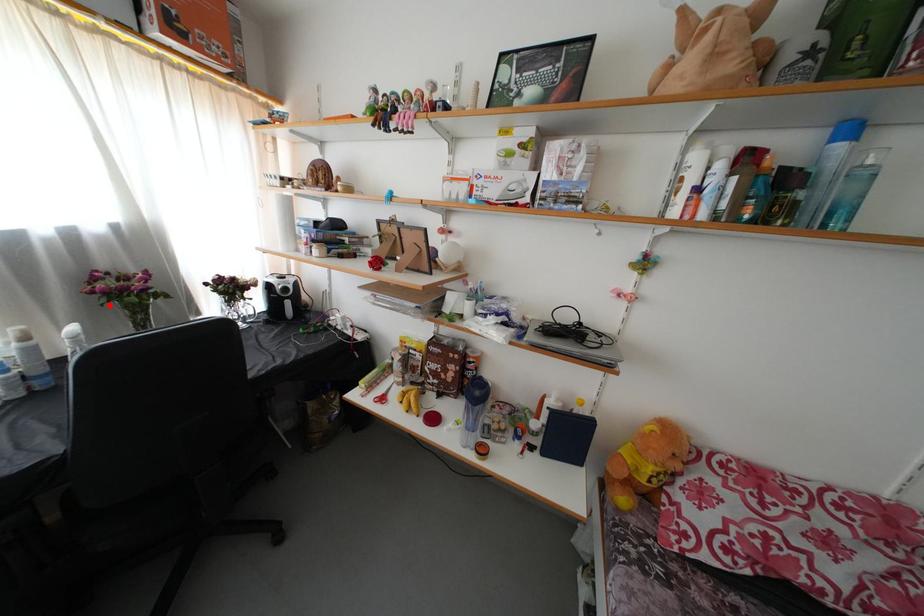
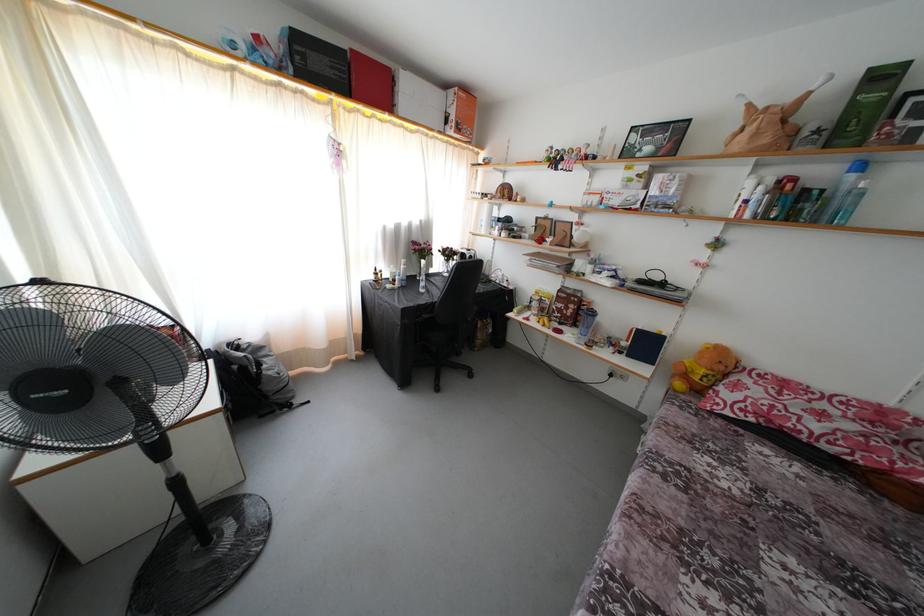
Question: A red point is marked in image1. In image2, is the corresponding 3D point closer to the camera or farther? Reply with the corresponding letter.

Choices:
 (A) The corresponding 3D point is closer.
 (B) The corresponding 3D point is farther.

Answer: (A)